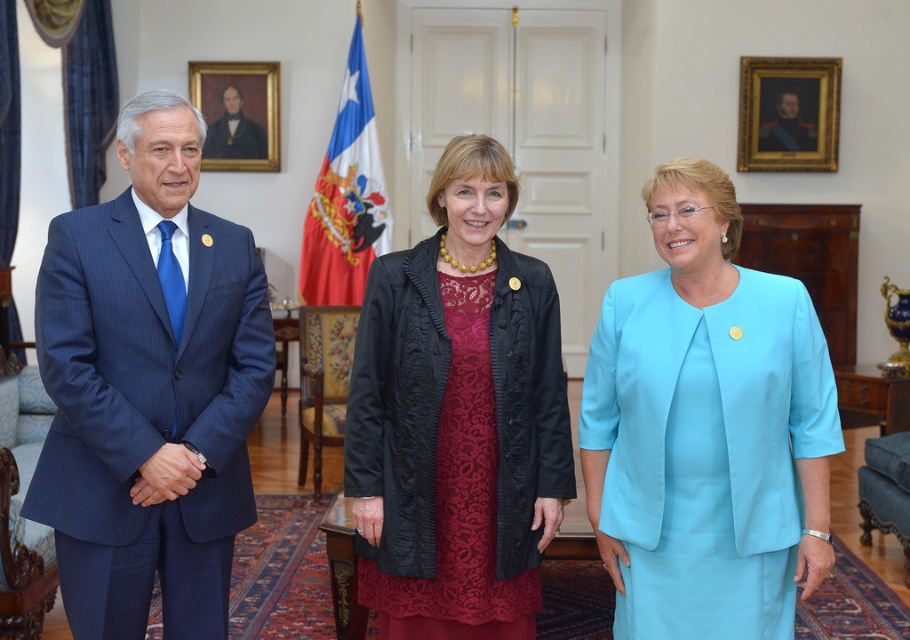
Question: Can you confirm if blue pinstripe suit at left is positioned below matte black coat at center?

Choices:
 (A) no
 (B) yes

Answer: (A)

Question: Which object is the farthest from the red-white flag at center?

Choices:
 (A) light blue satin suit at center
 (B) matte black coat at center

Answer: (A)

Question: Which of the following is the farthest from the observer?

Choices:
 (A) coord(403,413)
 (B) coord(364,170)
 (C) coord(144,480)
 (D) coord(646,557)

Answer: (B)

Question: Is light blue satin suit at center to the right of matte black coat at center from the viewer's perspective?

Choices:
 (A) no
 (B) yes

Answer: (B)

Question: Does light blue satin suit at center appear on the right side of matte black coat at center?

Choices:
 (A) yes
 (B) no

Answer: (A)

Question: Which point is farther from the camera taking this photo?

Choices:
 (A) (229, 150)
 (B) (330, 252)
 (C) (364, 330)
 (D) (673, 216)

Answer: (A)